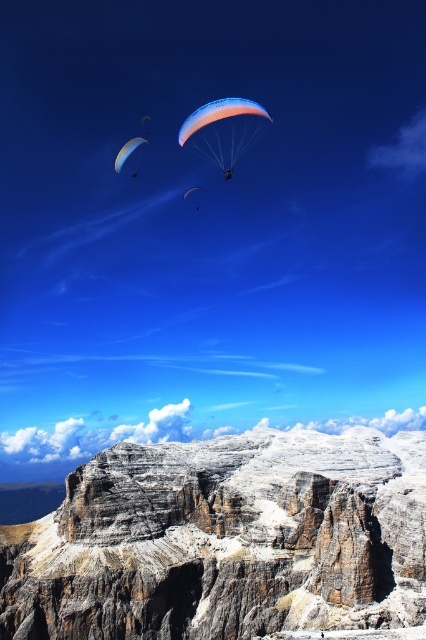
You are a pilot observing the mountain landscape. You notice a translucent orange parachute at center and a matte blue parachute at upper left. Which parachute is closer to you based on their positions?

The translucent orange parachute at center is closer to you because it is in front of the matte blue parachute at upper left.

You are a hiker standing at the base of the rocky cliff at lower center and want to reach the matte orange parachute at upper center. Can you see the parachute from your current position?

The rocky cliff at lower center is in front of the matte orange parachute at upper center, so the cliff may block your view. You might not be able to see the parachute directly from the base of the cliff.